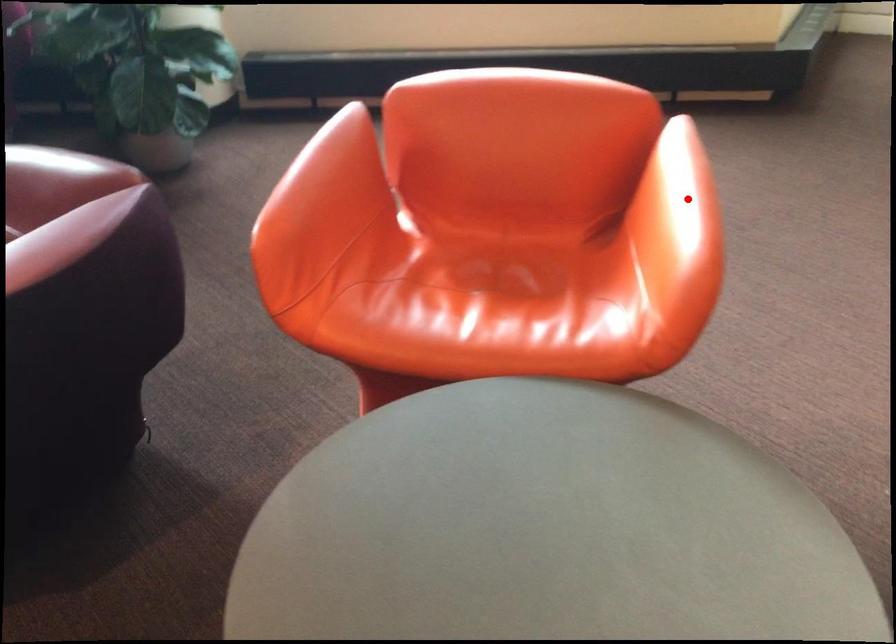
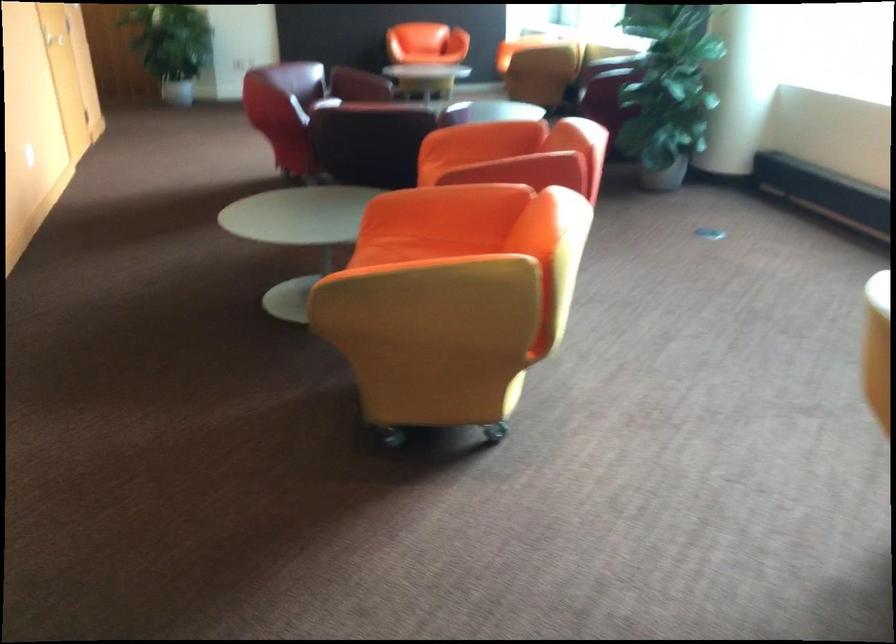
Question: I am providing you with two images of the same scene from different viewpoints. In image1, a red point is highlighted. Considering the same 3D point in image2, which of the following is correct?

Choices:
 (A) It is closer
 (B) It is farther

Answer: (B)